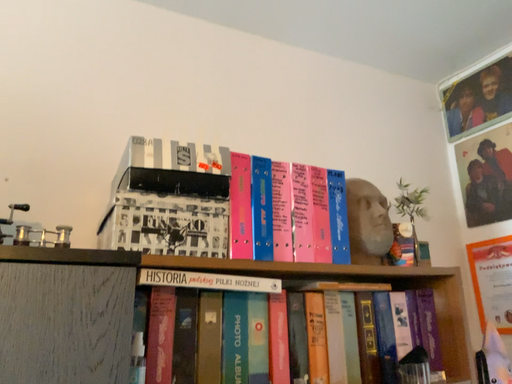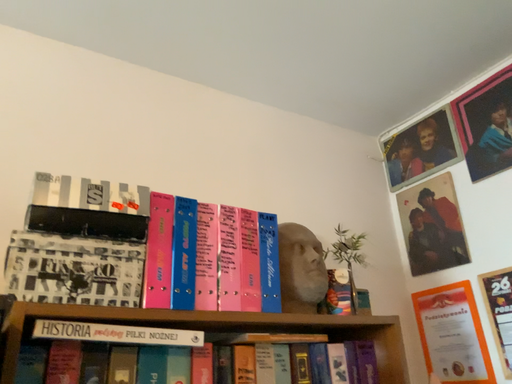
Question: Which way did the camera rotate in the video?

Choices:
 (A) rotated upward
 (B) rotated downward

Answer: (A)